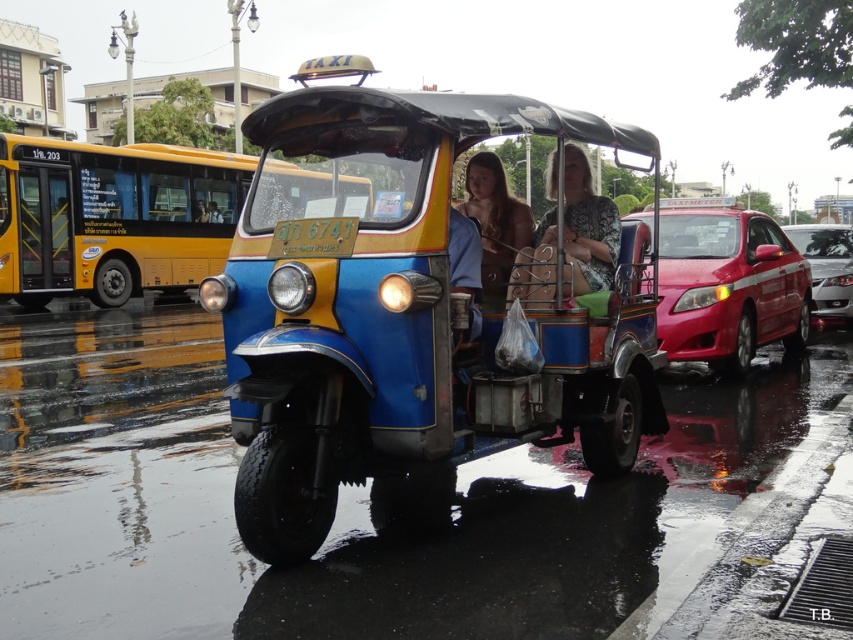
Question: Does yellow metallic bus at left appear over patterned fabric bag at center?

Choices:
 (A) no
 (B) yes

Answer: (B)

Question: Which object is closer to the camera taking this photo?

Choices:
 (A) yellow metallic bus at left
 (B) shiny blue tuk-tuk at center

Answer: (B)

Question: Which of the following is the closest to the observer?

Choices:
 (A) shiny red sedan at right
 (B) brown leather jacket at center
 (C) yellow metallic bus at left

Answer: (C)

Question: Can you confirm if yellow metallic bus at left is thinner than patterned fabric bag at center?

Choices:
 (A) no
 (B) yes

Answer: (A)

Question: Which point is closer to the camera?

Choices:
 (A) shiny red sedan at right
 (B) patterned fabric bag at center
 (C) shiny blue tuk-tuk at center

Answer: (C)

Question: Does shiny blue tuk-tuk at center have a greater width compared to shiny red car at right?

Choices:
 (A) yes
 (B) no

Answer: (A)